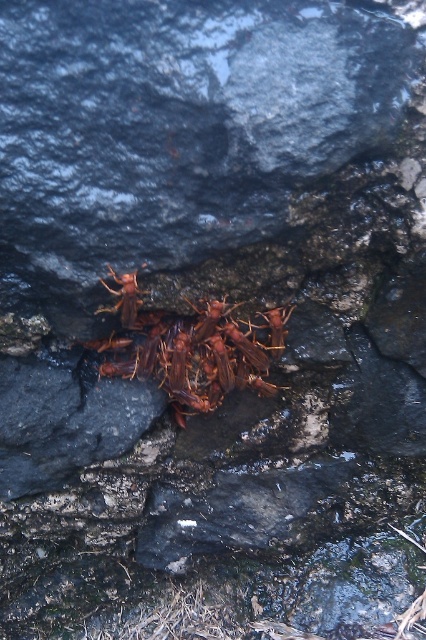
Measure the distance between point (111, 374) and camera.

Point (111, 374) is 36.86 inches away from camera.

What do you see at coordinates (192, 348) in the screenshot? The height and width of the screenshot is (640, 426). I see `brown matte insects at center` at bounding box center [192, 348].

Is point (261, 369) positioned behind point (126, 304)?

Yes, it is.

Where is `brown matte insects at center`? brown matte insects at center is located at coordinates [x=192, y=348].